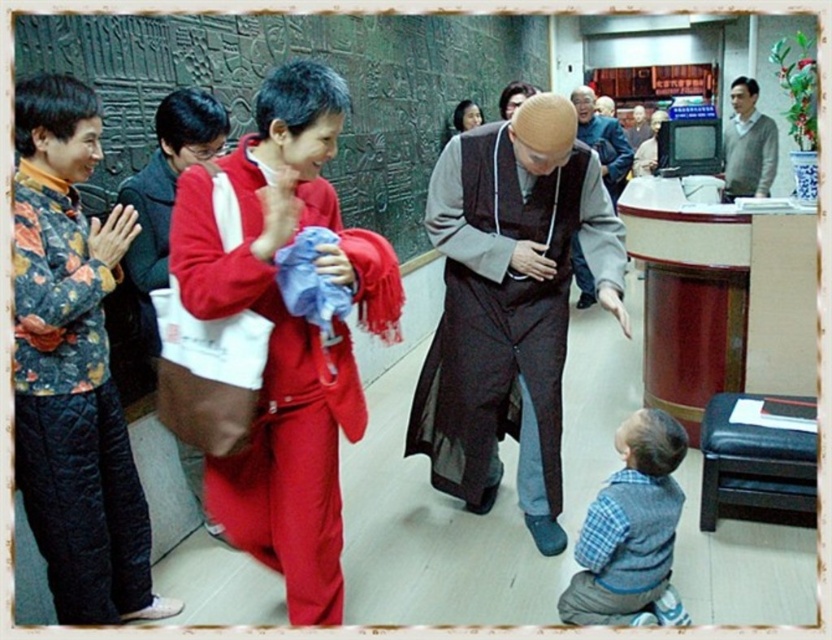
You are a photographer trying to capture a clear shot of the brown matte robe at center and the blue plaid shirt at lower right. However, the robe is partially blocking the view of the shirt. Can you adjust your position to see both items fully without moving any objects?

The brown matte robe at center is positioned over the blue plaid shirt at lower right, so moving to a side angle might allow you to see both items fully without obstruction.

You are a visitor standing at the entrance of the temple. You want to approach the brown matte robe at center to admire it up close. However, there is a rule that you must stay at least 2 meters away from any sacred objects. Can you safely approach the robe without violating the rule?

The distance between you and the brown matte robe at center is 2.29 meters, which is more than the required 2 meters. Therefore, you can safely approach the robe without breaking the rule.